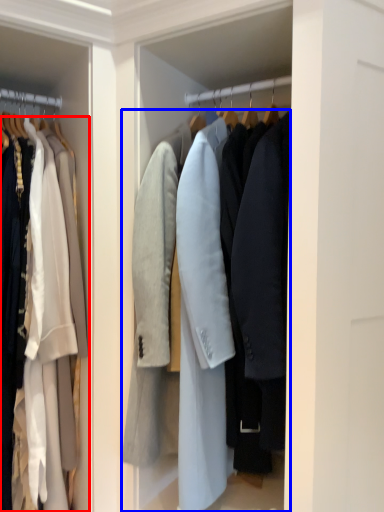
Question: Which point is further to the camera, coat (highlighted by a red box) or coat (highlighted by a blue box)?

Choices:
 (A) coat
 (B) coat

Answer: (A)